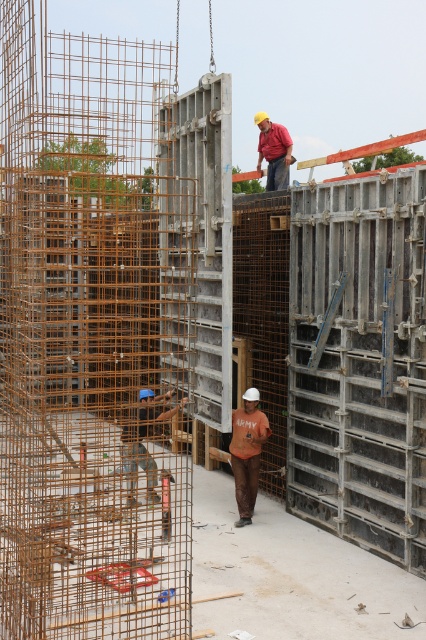
From the picture: You are a safety inspector observing the construction site. You notice two workers wearing orange cotton shirt at center and red fabric shirt at upper center. Which worker is positioned higher in the scene?

The red fabric shirt at upper center is higher because it is positioned above the orange cotton shirt at center.

What object is located at the coordinates point (x=141, y=440)?

The blue hard hat at center is located at point (x=141, y=440).